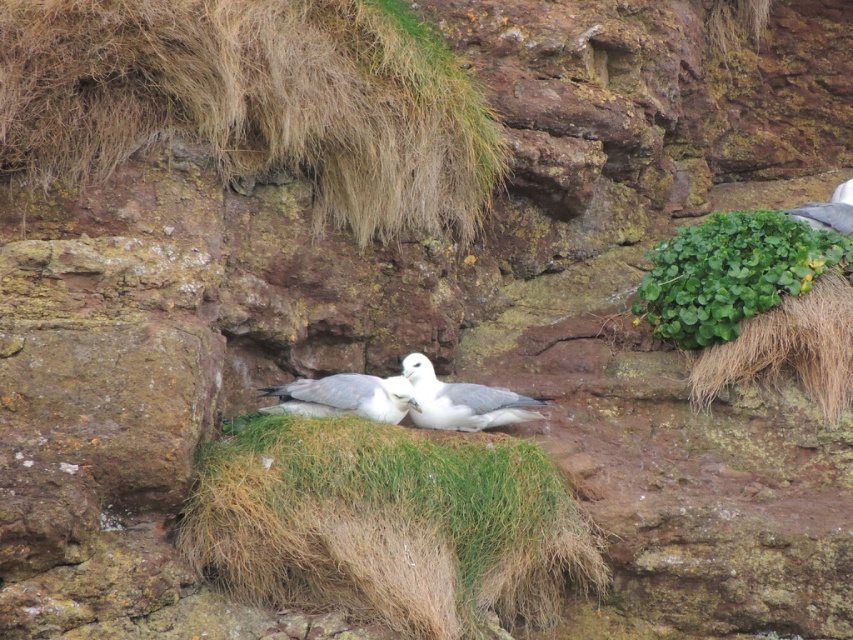
Is white matte bird at center closer to camera compared to white feathered bird at center?

No.

Locate an element on the screen. This screenshot has height=640, width=853. white matte bird at center is located at coordinates (462, 401).

At what (x,y) coordinates should I click in order to perform the action: click on white matte bird at center. Please return your answer as a coordinate pair (x, y). Image resolution: width=853 pixels, height=640 pixels. Looking at the image, I should click on (462, 401).

I want to click on white matte bird at center, so click(x=462, y=401).

Does green leafy plant at upper right have a lesser width compared to white matte bird at center?

In fact, green leafy plant at upper right might be wider than white matte bird at center.

Does green leafy plant at upper right have a lesser height compared to white matte bird at center?

No.

Locate an element on the screen. green leafy plant at upper right is located at coordinates (732, 273).

Who is shorter, brown grassy hillside at upper left or gray feathered bird at upper right?

gray feathered bird at upper right is shorter.

Between point (434, 96) and point (805, 220), which one is positioned in front?

Point (434, 96) is in front.

Identify the location of brown grassy hillside at upper left. (254, 100).